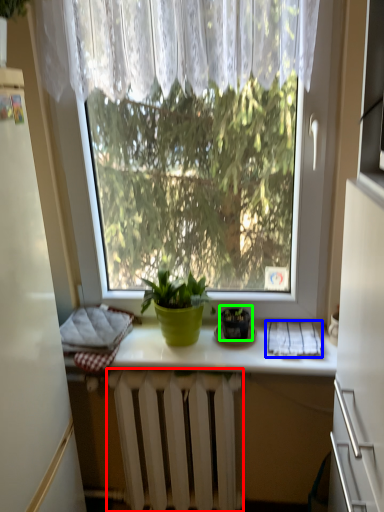
Question: Estimate the real-world distances between objects in this image. Which object is closer to radiator (highlighted by a red box), cloth (highlighted by a blue box) or houseplant (highlighted by a green box)?

Choices:
 (A) cloth
 (B) houseplant

Answer: (B)